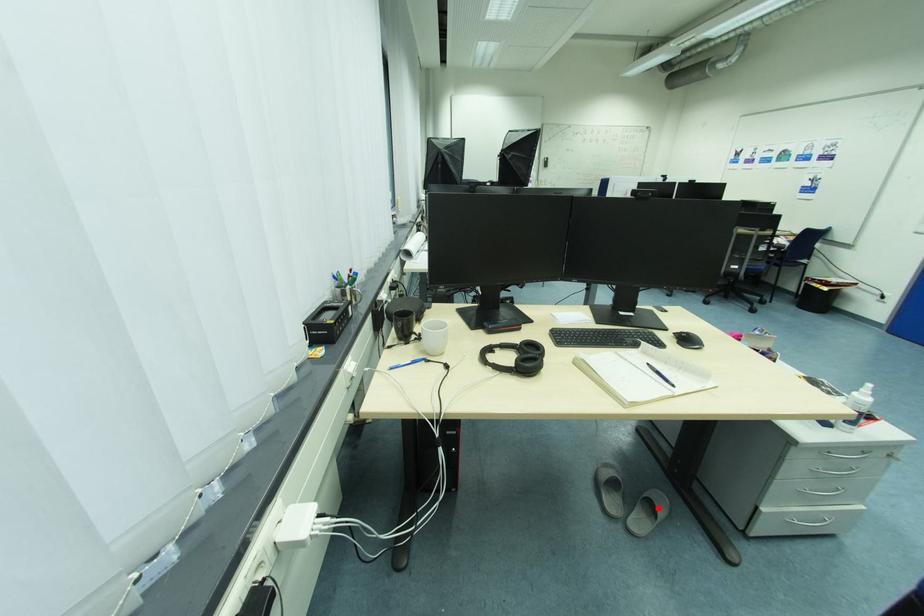
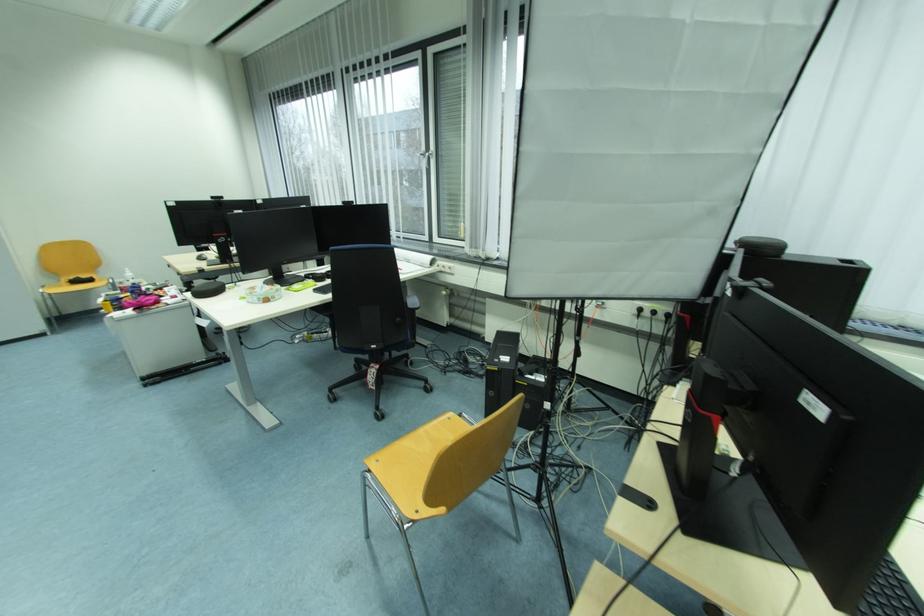
Question: I am providing you with two images of the same scene from different viewpoints. A red point is marked on the first image. At the location where the point appears in image 1, is it still visible in image 2?

Choices:
 (A) Yes
 (B) No

Answer: (B)